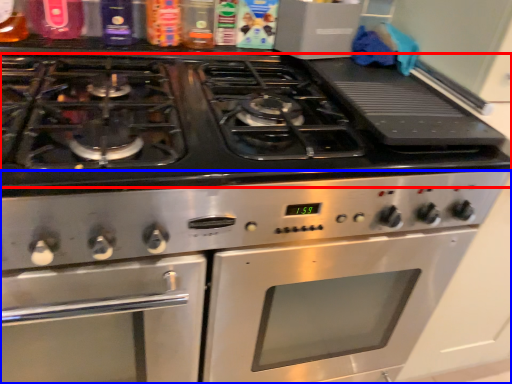
Question: Which of the following is the farthest to the observer, gas stove (highlighted by a red box) or oven (highlighted by a blue box)?

Choices:
 (A) gas stove
 (B) oven

Answer: (B)